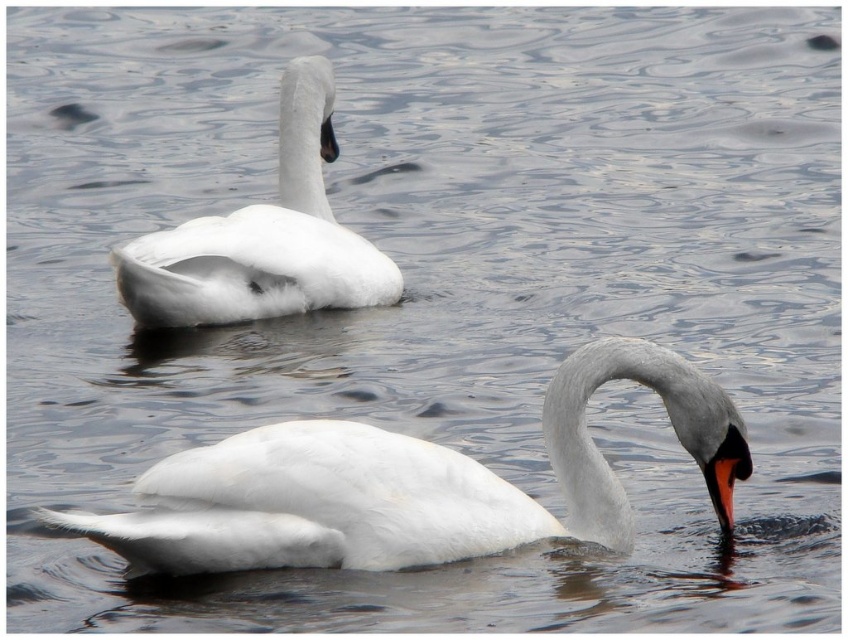
Question: Can you confirm if white glossy swan at lower center is positioned to the left of white matte swan at upper left?

Choices:
 (A) no
 (B) yes

Answer: (A)

Question: Among these points, which one is farthest from the camera?

Choices:
 (A) (339, 291)
 (B) (704, 467)

Answer: (A)

Question: Which of the following is the closest to the observer?

Choices:
 (A) (132, 296)
 (B) (271, 556)

Answer: (B)

Question: Is white glossy swan at lower center smaller than white matte swan at upper left?

Choices:
 (A) no
 (B) yes

Answer: (A)

Question: Does white glossy swan at lower center appear on the left side of white matte swan at upper left?

Choices:
 (A) yes
 (B) no

Answer: (B)

Question: Which point is farther from the camera taking this photo?

Choices:
 (A) (589, 509)
 (B) (124, 300)

Answer: (B)